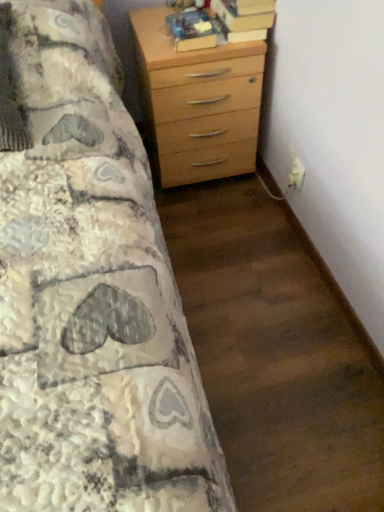
Where is `free space above hardcover book at upper center, marked as the second book in a right-to-left arrangement (from a real-world perspective)`? This screenshot has height=512, width=384. free space above hardcover book at upper center, marked as the second book in a right-to-left arrangement (from a real-world perspective) is located at coordinates (193, 18).